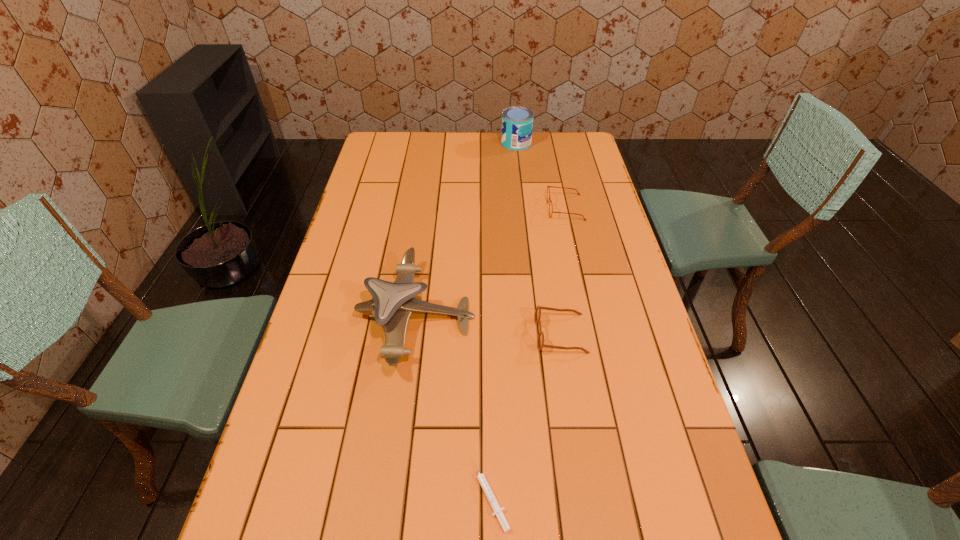
You are a GUI agent. You are given a task and a screenshot of the screen. Output one action in this format:
    pyautogui.click(x=<x>, y=<y>)
    Task: Click on the vacant space located on the face of the farther spectacles
    The image size is (960, 540).
    Given the screenshot: What is the action you would take?
    pyautogui.click(x=497, y=208)

Find the location of `vacant space situated 0.180m on the face of the farther spectacles`. vacant space situated 0.180m on the face of the farther spectacles is located at coordinates (497, 208).

Locate an element on the screen. This screenshot has width=960, height=540. vacant region located 0.100m on the front-facing side of the nearer spectacles is located at coordinates (498, 334).

At what (x,y) coordinates should I click in order to perform the action: click on vacant position located on the front-facing side of the nearer spectacles. Please return your answer as a coordinate pair (x, y). The width and height of the screenshot is (960, 540). Looking at the image, I should click on (413, 334).

You are a GUI agent. You are given a task and a screenshot of the screen. Output one action in this format:
    pyautogui.click(x=<x>, y=<y>)
    Task: Click on the vacant space located on the front-facing side of the nearer spectacles
    The height and width of the screenshot is (540, 960).
    Given the screenshot: What is the action you would take?
    pyautogui.click(x=468, y=334)

This screenshot has height=540, width=960. I want to click on vacant space located on the back of the shortest object, so click(487, 318).

Where is `object that is positioned at the far edge`? object that is positioned at the far edge is located at coordinates (517, 122).

At what (x,y) coordinates should I click in order to perform the action: click on object that is positioned at the left edge. Please return your answer as a coordinate pair (x, y). The image size is (960, 540). Looking at the image, I should click on (393, 303).

Find the location of a particular element. This screenshot has height=540, width=960. object present at the right edge is located at coordinates (547, 186).

In the image, there is a desktop. In order to click on vacant space at the far edge in this screenshot , I will do `click(512, 159)`.